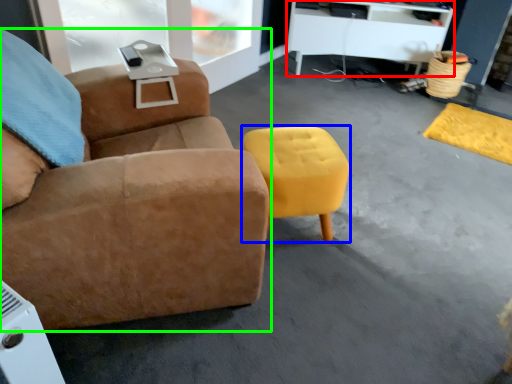
Question: Which object is the farthest from desk (highlighted by a red box)? Choose among these: stool (highlighted by a blue box) or chair (highlighted by a green box).

Choices:
 (A) stool
 (B) chair

Answer: (B)